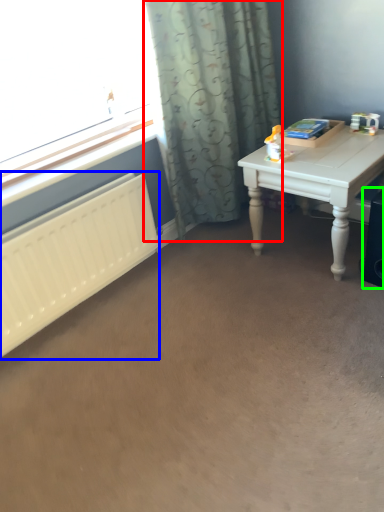
Question: Which object is positioned farthest from curtain (highlighted by a red box)? Select from radiator (highlighted by a blue box) and speaker (highlighted by a green box).

Choices:
 (A) radiator
 (B) speaker

Answer: (B)